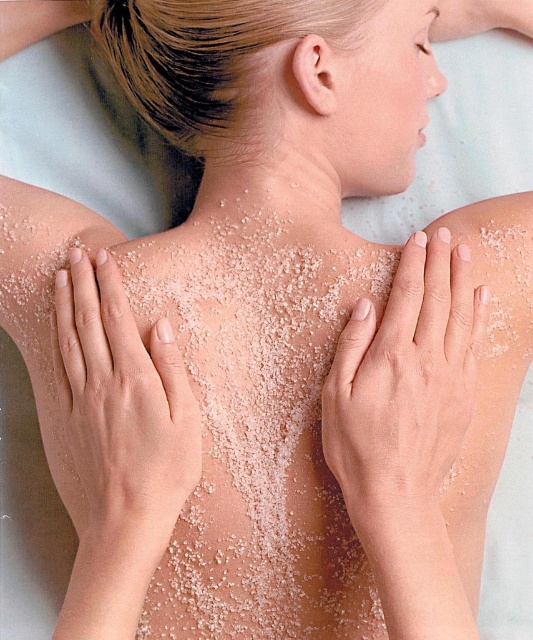
In the spa scene, there is a person lying down with their back exposed. Their back has fine white granules covering it, and their hands are on their shoulders. A point labeled as point (405,387) is shown. Where on the person is this point located?

Point (405,387) is located at the smooth skin at upper center of the person.

In the spa scene, you notice two areas on the person depicted. One is the smooth skin at left and the other is the white granular skin at center. Which area is positioned to the left?

The smooth skin at left is positioned to the left of the white granular skin at center.